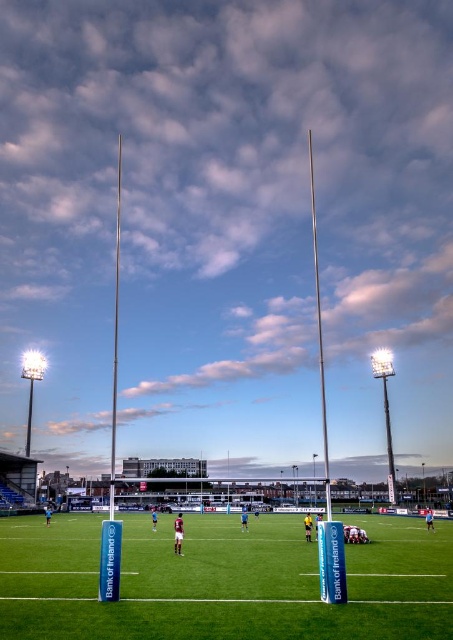
Is point (366, 563) positioned behind point (318, 275)?

No, it is in front of (318, 275).

Is green grass field at center thinner than polished silver pole at center?

Incorrect, green grass field at center's width is not less than polished silver pole at center's.

Between point (369, 570) and point (322, 413), which one is positioned in front?

Point (369, 570)

The image size is (453, 640). Identify the location of green grass field at center. (222, 580).

Find the location of a particular element. The image size is (453, 640). polished silver pole at center is located at coordinates (318, 332).

The height and width of the screenshot is (640, 453). I want to click on polished silver pole at center, so click(x=318, y=332).

Describe the element at coordinates (222, 580) in the screenshot. I see `green grass field at center` at that location.

Is point (449, 618) closer to viewer compared to point (115, 326)?

Yes, it is in front of point (115, 326).

Locate an element on the screen. The width and height of the screenshot is (453, 640). green grass field at center is located at coordinates (222, 580).